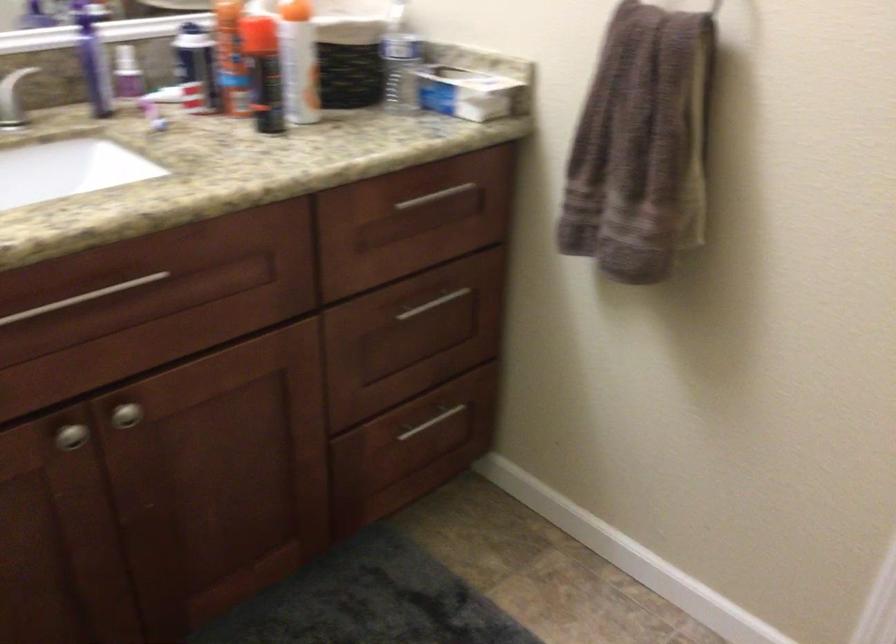
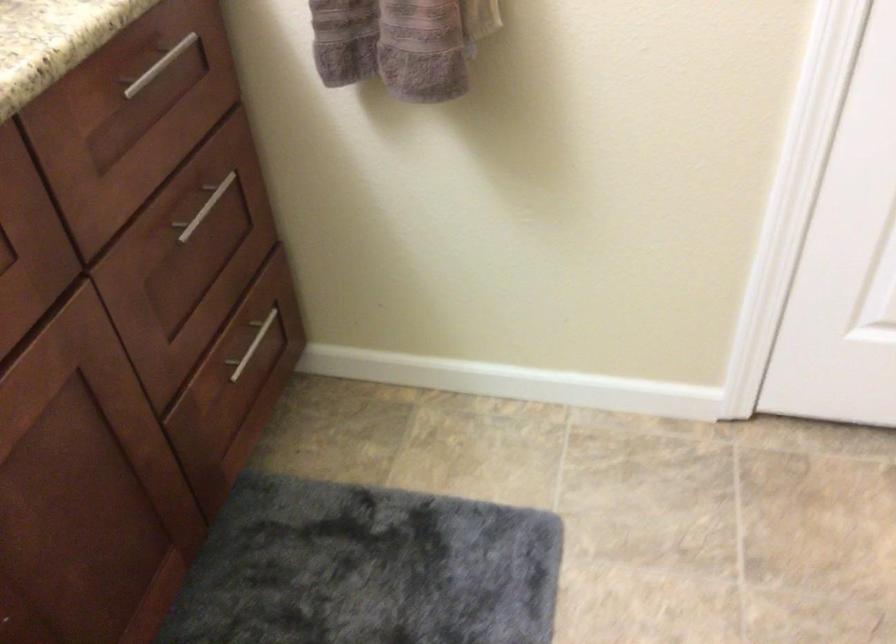
Where in the second image is the point corresponding to (x=427, y=303) from the first image?

(203, 207)